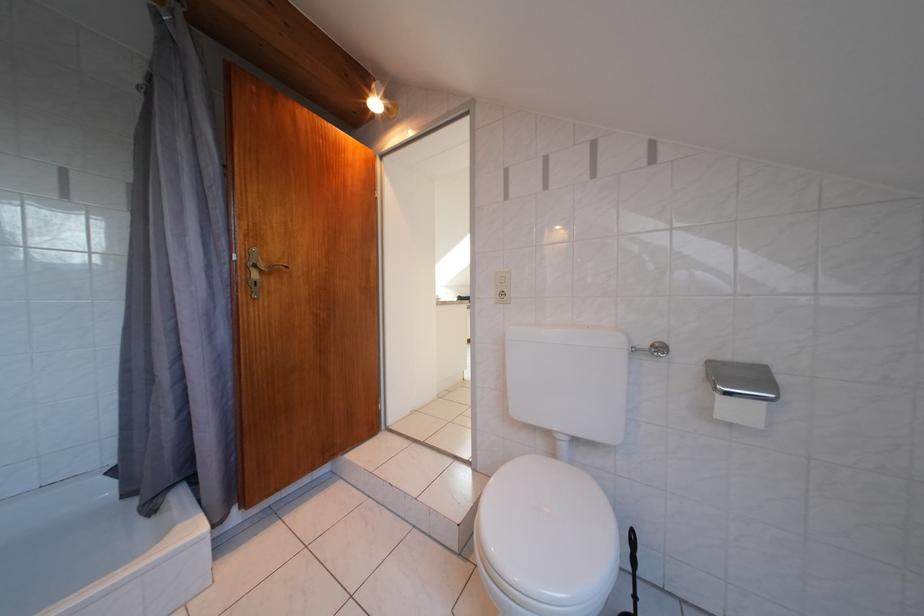
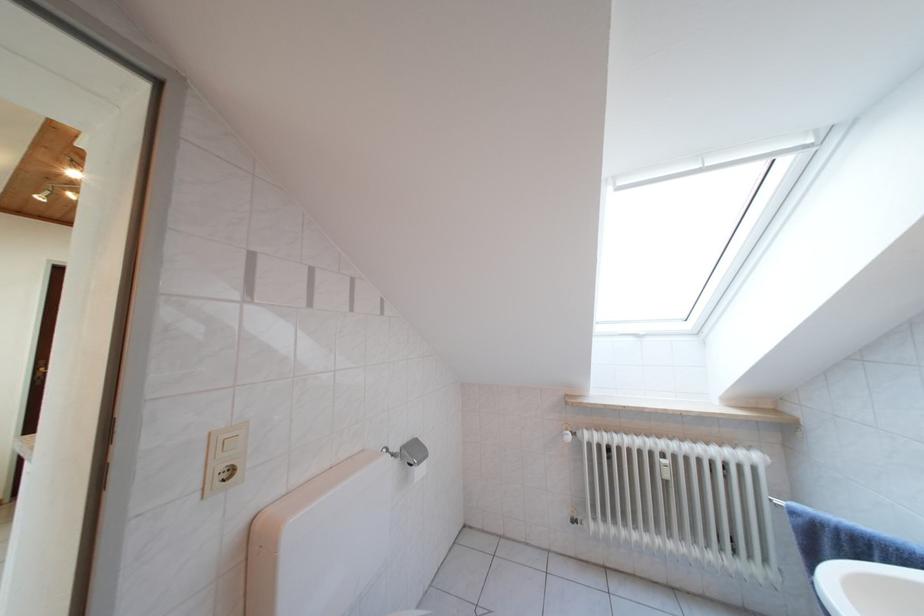
Question: The camera is either moving clockwise (left) or counter-clockwise (right) around the object. The first image is from the beginning of the video and the second image is from the end. Is the camera moving left or right when shooting the video?

Choices:
 (A) Left
 (B) Right

Answer: (A)